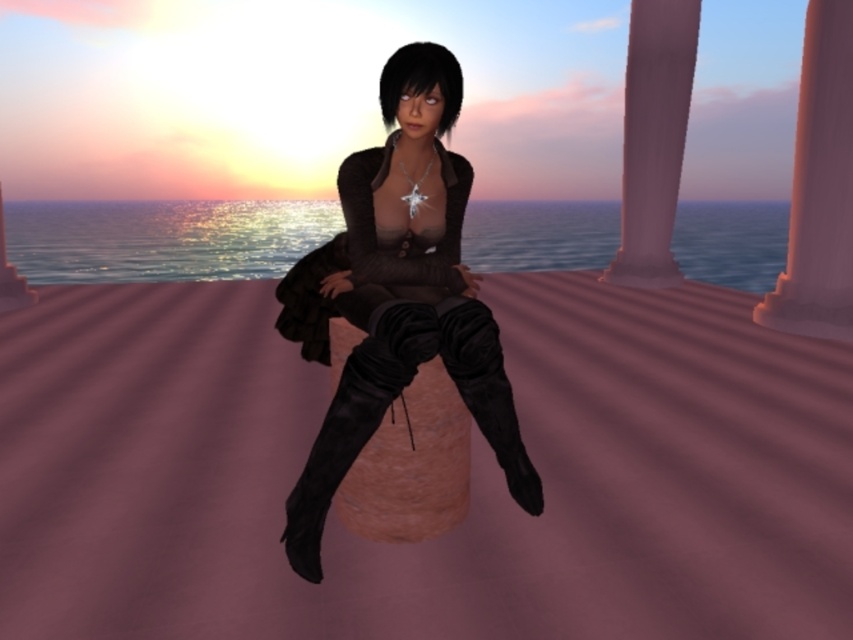
You are a game developer designing a virtual environment. You need to place an NPC at coordinates that are 0.3 units to the right and 0.2 units above the matte black boots at center. What are the new coordinates for the NPC?

The new coordinates for the NPC would be calculated by adding 0.3 to the x coordinate and 0.2 to the y coordinate of the matte black boots at center. The original coordinates are (397,296). Adding 0.3 to the x gives 0.463 0.3 0.763, and adding 0.2 to the y gives 0.467 0.2 0.667. So the new coordinates are (567,488).

You are a game developer designing a virtual environment. You need to place an object at the location marked by point (819, 186). What object is already present at this coordinate according to the scene description?

The smooth pink stone pillar at right is already present at point (819, 186).

You are an interior designer planning to place a new decorative item between the matte black boots at center and the smooth pink stone pillar at right. Considering their sizes, which object should the new item be placed closer to?

The new decorative item should be placed closer to the matte black boots at center since it has a smaller size compared to the smooth pink stone pillar at right.